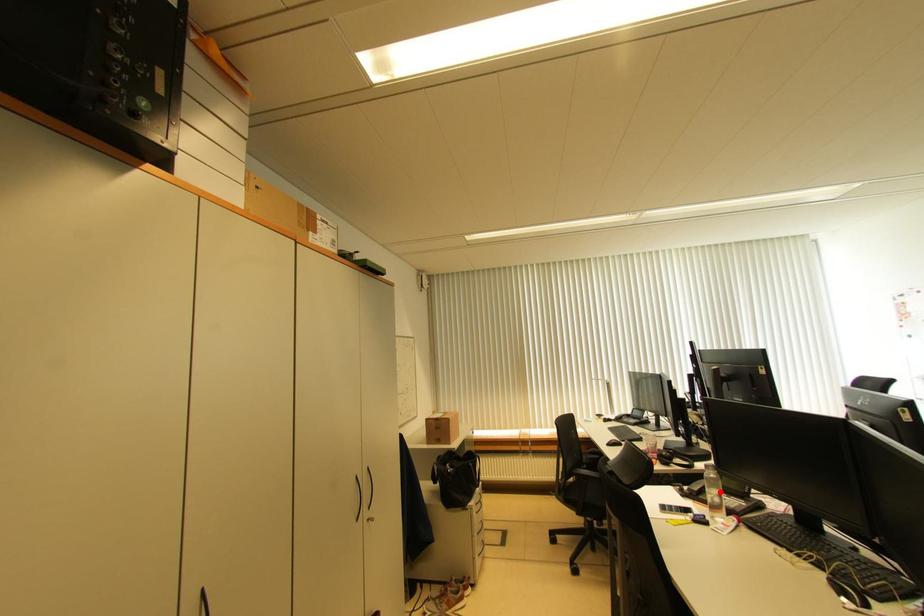
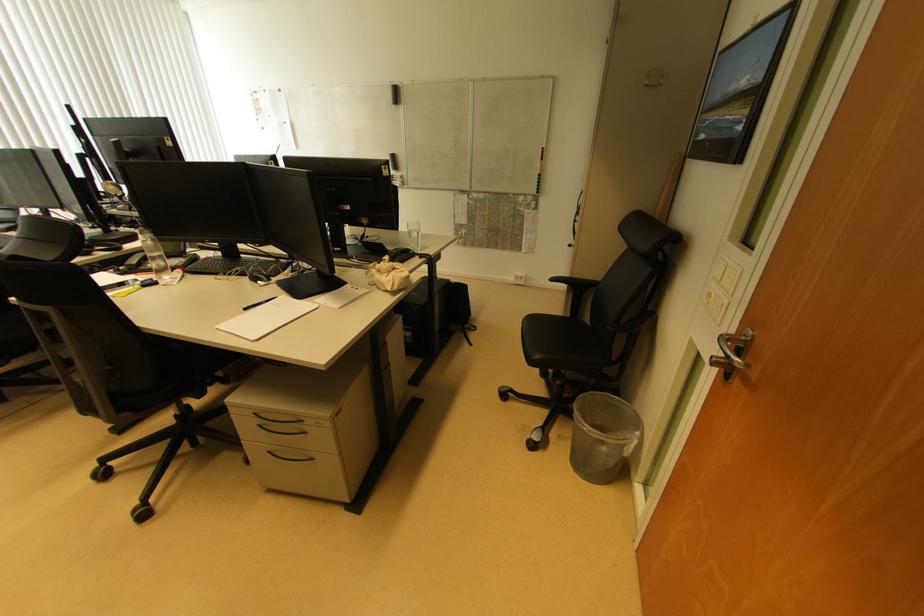
In the second image, find the point that corresponds to the highlighted location in the first image.

(161, 254)